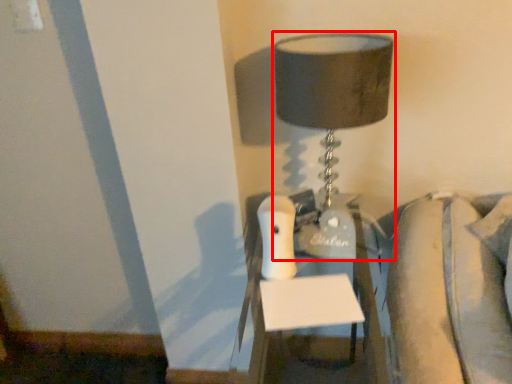
Question: Considering the relative positions of lamp (annotated by the red box) and furniture in the image provided, where is lamp (annotated by the red box) located with respect to the staircase?

Choices:
 (A) left
 (B) right

Answer: (A)